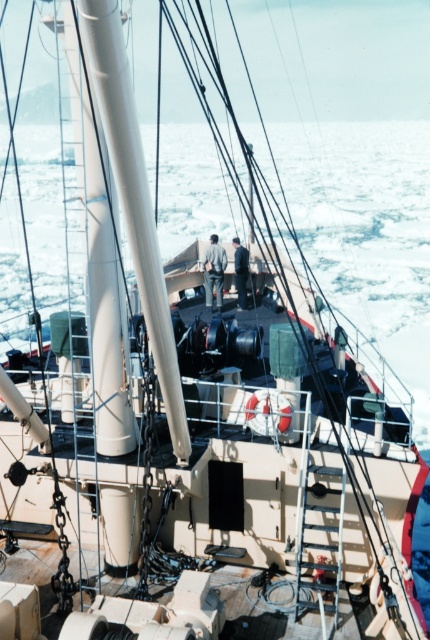
You are a crew member on the ship and need to locate your dark gray fabric pants at center and dark gray fabric jacket at center. Which item is closer to you when you look straight ahead?

The dark gray fabric pants at center is in front of the dark gray fabric jacket at center, so the pants are closer to you.